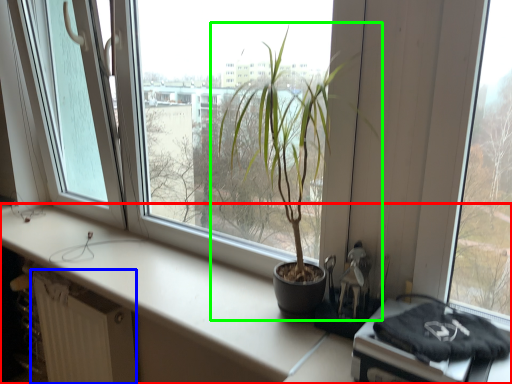
Question: Which object is the closest to the counter top (highlighted by a red box)? Choose among these: radiator (highlighted by a blue box) or houseplant (highlighted by a green box).

Choices:
 (A) radiator
 (B) houseplant

Answer: (A)